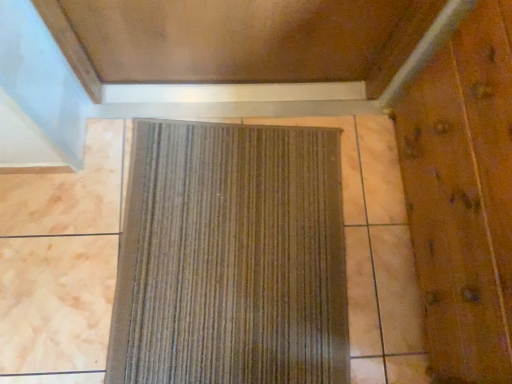
Measure the distance between wooden elevator door at right and camera.

wooden elevator door at right and camera are 30.28 inches apart from each other.

The image size is (512, 384). What do you see at coordinates (463, 197) in the screenshot? I see `wooden elevator door at right` at bounding box center [463, 197].

Find the location of `wooden elevator door at right`. wooden elevator door at right is located at coordinates (463, 197).

This screenshot has height=384, width=512. What do you see at coordinates (231, 258) in the screenshot?
I see `brown textured mat at center` at bounding box center [231, 258].

Locate an element on the screen. This screenshot has width=512, height=384. brown textured mat at center is located at coordinates (231, 258).

The image size is (512, 384). Identify the location of wooden elevator door at right. (463, 197).

Considering the relative positions of wooden elevator door at right and brown textured mat at center in the image provided, is wooden elevator door at right to the right of brown textured mat at center from the viewer's perspective?

Yes.

Is wooden elevator door at right closer to the viewer compared to brown textured mat at center?

Yes, wooden elevator door at right is closer to the camera.

Is point (481, 289) closer to camera compared to point (221, 188)?

Yes, point (481, 289) is in front of point (221, 188).

From the image's perspective, would you say wooden elevator door at right is shown under brown textured mat at center?

No, from the image's perspective, wooden elevator door at right is not beneath brown textured mat at center.

From a real-world perspective, does wooden elevator door at right sit lower than brown textured mat at center?

Incorrect, from a real-world perspective, wooden elevator door at right is higher than brown textured mat at center.

In the scene shown: Which of these two, wooden elevator door at right or brown textured mat at center, is thinner?

With smaller width is wooden elevator door at right.

Between wooden elevator door at right and brown textured mat at center, which one has more height?

wooden elevator door at right is taller.

Considering the relative sizes of wooden elevator door at right and brown textured mat at center in the image provided, is wooden elevator door at right bigger than brown textured mat at center?

Correct, wooden elevator door at right is larger in size than brown textured mat at center.

Looking at this image, could brown textured mat at center be considered to be inside wooden elevator door at right?

No.

Is wooden elevator door at right directly adjacent to brown textured mat at center?

wooden elevator door at right and brown textured mat at center are clearly separated.

Could you tell me if wooden elevator door at right is facing brown textured mat at center?

Yes, wooden elevator door at right is turned towards brown textured mat at center.

Identify the location of elevator door in front of the brown textured mat at center. (463, 197).

Which object is positioned more to the right, brown textured mat at center or wooden elevator door at right?

From the viewer's perspective, wooden elevator door at right appears more on the right side.

Is brown textured mat at center behind wooden elevator door at right?

Yes, it is.

Between point (266, 133) and point (463, 278), which one is positioned behind?

Positioned behind is point (266, 133).

From the image's perspective, is brown textured mat at center below wooden elevator door at right?

Correct, brown textured mat at center appears lower than wooden elevator door at right in the image.

From a real-world perspective, relative to wooden elevator door at right, is brown textured mat at center vertically above or below?

From a real-world perspective, brown textured mat at center is physically below wooden elevator door at right.

Does brown textured mat at center have a lesser width compared to wooden elevator door at right?

No, brown textured mat at center is not thinner than wooden elevator door at right.

Considering the sizes of objects brown textured mat at center and wooden elevator door at right in the image provided, who is taller, brown textured mat at center or wooden elevator door at right?

Standing taller between the two is wooden elevator door at right.

Is brown textured mat at center bigger or smaller than wooden elevator door at right?

Clearly, brown textured mat at center is smaller in size than wooden elevator door at right.

Which is correct: brown textured mat at center is inside wooden elevator door at right, or outside of it?

brown textured mat at center is not enclosed by wooden elevator door at right.

Would you consider brown textured mat at center to be distant from wooden elevator door at right?

No, brown textured mat at center is in close proximity to wooden elevator door at right.

Is wooden elevator door at right at the back of brown textured mat at center?

Correct, brown textured mat at center is looking away from wooden elevator door at right.

How different are the orientations of brown textured mat at center and wooden elevator door at right in degrees?

5.8 degrees.

Find the location of a particular element. Image resolution: width=512 pixels, height=384 pixels. elevator door that is on the right side of brown textured mat at center is located at coordinates (463, 197).

Locate an element on the screen. Image resolution: width=512 pixels, height=384 pixels. curtain located on the left of wooden elevator door at right is located at coordinates (231, 258).

You are a GUI agent. You are given a task and a screenshot of the screen. Output one action in this format:
    pyautogui.click(x=<x>, y=<y>)
    Task: Click on the curtain below the wooden elevator door at right (from the image's perspective)
    Image resolution: width=512 pixels, height=384 pixels.
    Given the screenshot: What is the action you would take?
    pyautogui.click(x=231, y=258)